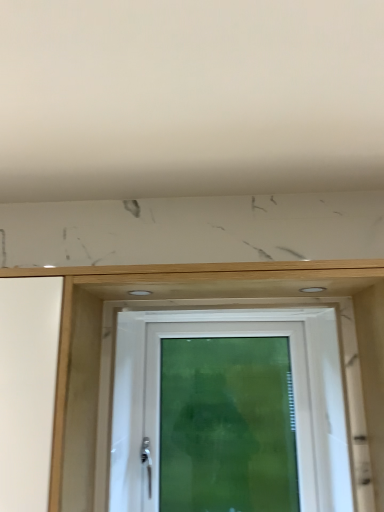
Question: Does point (321, 287) appear closer or farther from the camera than point (130, 293)?

Choices:
 (A) farther
 (B) closer

Answer: (B)

Question: From a real-world perspective, is matte white hole at upper center, arranged as the first hole when viewed from the right, positioned above or below white matte hole at upper center, the 2th hole in the right-to-left sequence?

Choices:
 (A) below
 (B) above

Answer: (B)

Question: Which object is positioned farthest from the white plastic door at center?

Choices:
 (A) matte white hole at upper center, the second hole in the left-to-right sequence
 (B) white matte hole at upper center, the 2th hole in the right-to-left sequence
 (C) white glossy screen door at center

Answer: (B)

Question: Based on their relative distances, which object is farther from the white glossy screen door at center?

Choices:
 (A) white matte hole at upper center, the 2th hole in the right-to-left sequence
 (B) matte white hole at upper center, the second hole in the left-to-right sequence
 (C) white plastic door at center

Answer: (B)